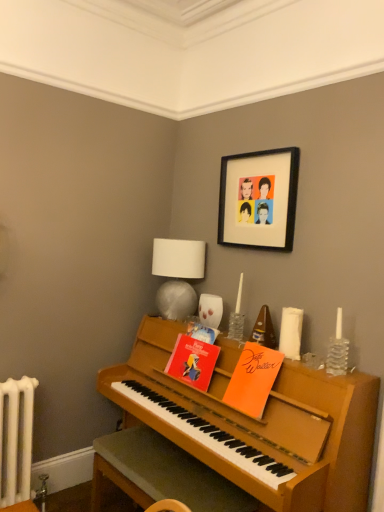
Question: Is orange matte book at center, the third book viewed from the left, inside the boundaries of red paper book at center, which is the 2th book in left-to-right order, or outside?

Choices:
 (A) outside
 (B) inside

Answer: (A)

Question: Is point (258, 386) positioned closer to the camera than point (192, 322)?

Choices:
 (A) closer
 (B) farther

Answer: (A)

Question: Which is nearer to the black matte picture frame at upper center?

Choices:
 (A) white fabric lampshade at upper center
 (B) wooden piano bench at center
 (C) red paper book at center, positioned as the first book in left-to-right order
 (D) red paper book at center, which is the 2th book in left-to-right order
 (E) clear glass candle at right

Answer: (A)

Question: Estimate the real-world distances between objects in this image. Which object is closer to the orange matte book at center, which is the first book in right-to-left order?

Choices:
 (A) wooden piano bench at center
 (B) red paper book at center, positioned as the first book in left-to-right order
 (C) white fabric lampshade at upper center
 (D) red paper book at center, which is the 2th book in left-to-right order
 (E) clear glass candle at right

Answer: (B)